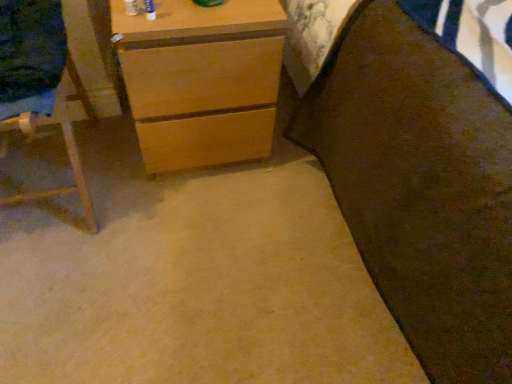
In order to click on vacant space in front of light brown wood chest of drawers at upper left in this screenshot , I will do `click(189, 228)`.